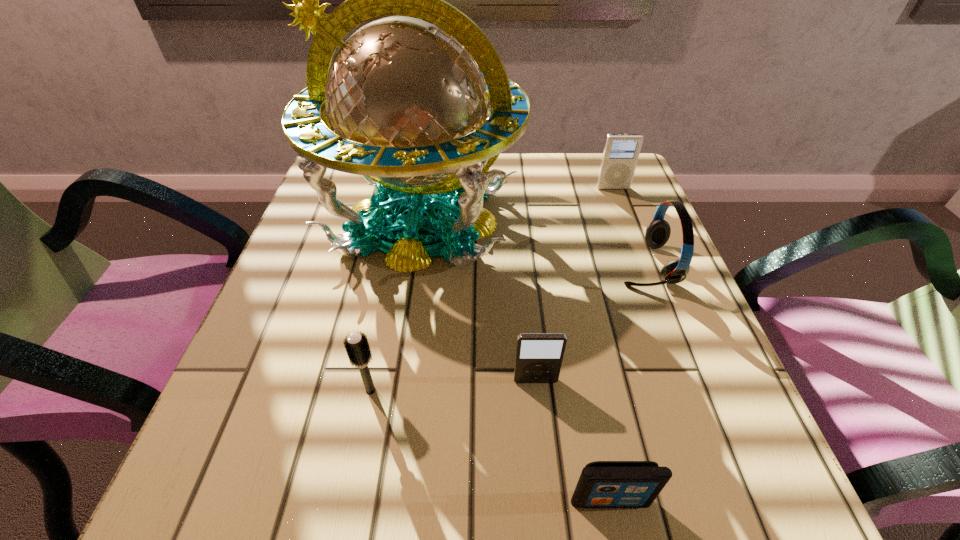
Locate an element on the screen. This screenshot has width=960, height=540. the tallest object is located at coordinates (405, 102).

Identify the location of the farthest iPod. The height and width of the screenshot is (540, 960). (621, 152).

Find the location of a particular element. This screenshot has height=540, width=960. the tallest iPod is located at coordinates (621, 152).

The image size is (960, 540). Identify the location of headset. point(657,234).

This screenshot has height=540, width=960. I want to click on hairbrush, so click(356, 345).

I want to click on the second shortest iPod, so click(539, 356).

What are the coordinates of `the shortest object` in the screenshot? It's located at (602, 484).

Locate an element on the screen. the nearest iPod is located at coordinates coord(602,484).

Identify the location of free point located 0.140m on the front of the tallest object. The image size is (960, 540). (401, 357).

Where is `free space located on the front-facing side of the tallest iPod`? The width and height of the screenshot is (960, 540). free space located on the front-facing side of the tallest iPod is located at coordinates (638, 255).